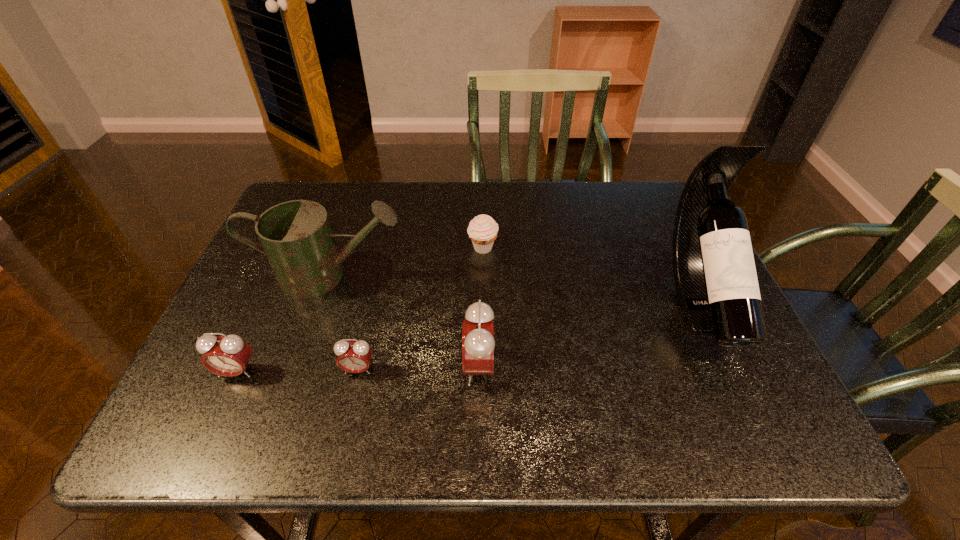
This screenshot has height=540, width=960. Find the location of `the leftmost alarm clock`. the leftmost alarm clock is located at coordinates (229, 355).

The width and height of the screenshot is (960, 540). I want to click on the second alarm clock from left to right, so pyautogui.click(x=354, y=357).

Locate an element on the screen. This screenshot has height=540, width=960. the rightmost alarm clock is located at coordinates (478, 343).

I want to click on the third tallest object, so click(478, 343).

Locate an element on the screen. muffin is located at coordinates (482, 230).

I want to click on the rightmost object, so click(x=715, y=277).

The height and width of the screenshot is (540, 960). I want to click on the tallest object, so click(715, 277).

This screenshot has width=960, height=540. Find the location of `watering can`. watering can is located at coordinates (296, 236).

This screenshot has height=540, width=960. What are the coordinates of `free space located on the clock face of the tallest alarm clock` in the screenshot? It's located at pyautogui.click(x=425, y=367).

You are a GUI agent. You are given a task and a screenshot of the screen. Output one action in this format:
    pyautogui.click(x=<x>, y=<y>)
    Task: Click on the vacant space located 0.220m on the clock face of the tallest alarm clock
    This screenshot has height=540, width=960.
    Given the screenshot: What is the action you would take?
    pyautogui.click(x=359, y=367)